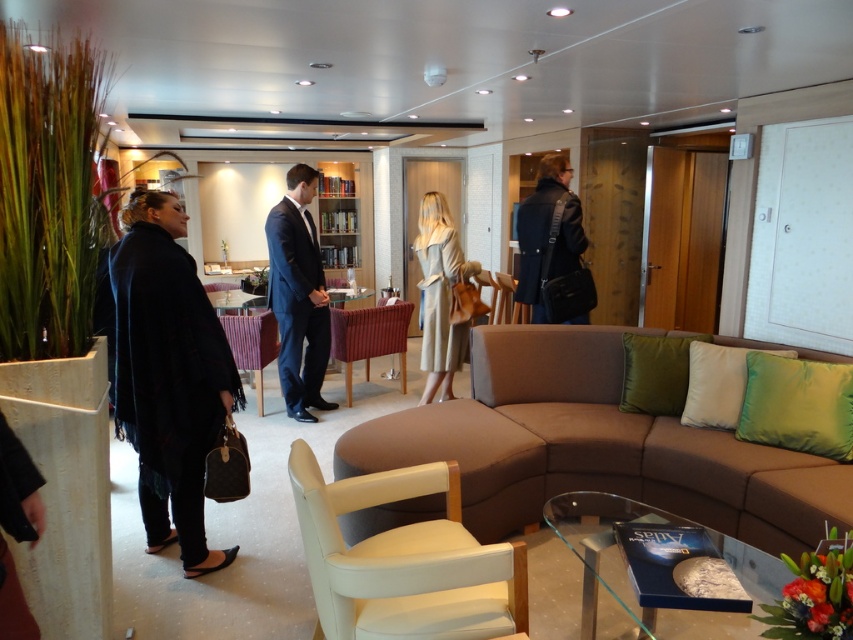
Is white leather armchair at lower left taller than transparent glass table at center?

Correct, white leather armchair at lower left is much taller as transparent glass table at center.

Between point (508, 580) and point (779, 582), which one is positioned in front?

Point (508, 580)

Which is in front, point (318, 595) or point (648, 621)?

Positioned in front is point (648, 621).

Image resolution: width=853 pixels, height=640 pixels. I want to click on white leather armchair at lower left, so click(x=404, y=561).

In order to click on dark blue woolen shawl at left in this screenshot , I will do `click(167, 376)`.

How much distance is there between dark blue woolen shawl at left and velvet purple armchair at center?

A distance of 2.02 meters exists between dark blue woolen shawl at left and velvet purple armchair at center.

What do you see at coordinates (167, 376) in the screenshot?
I see `dark blue woolen shawl at left` at bounding box center [167, 376].

This screenshot has width=853, height=640. I want to click on dark blue woolen shawl at left, so click(167, 376).

Between brown fabric couch at center and velvet purple armchair at center, which one has more height?

brown fabric couch at center is taller.

Which is in front, point (621, 467) or point (268, 330)?

Point (621, 467) is in front.

What do you see at coordinates (593, 445) in the screenshot? This screenshot has height=640, width=853. I see `brown fabric couch at center` at bounding box center [593, 445].

Find the location of `brown fabric couch at center`. brown fabric couch at center is located at coordinates (593, 445).